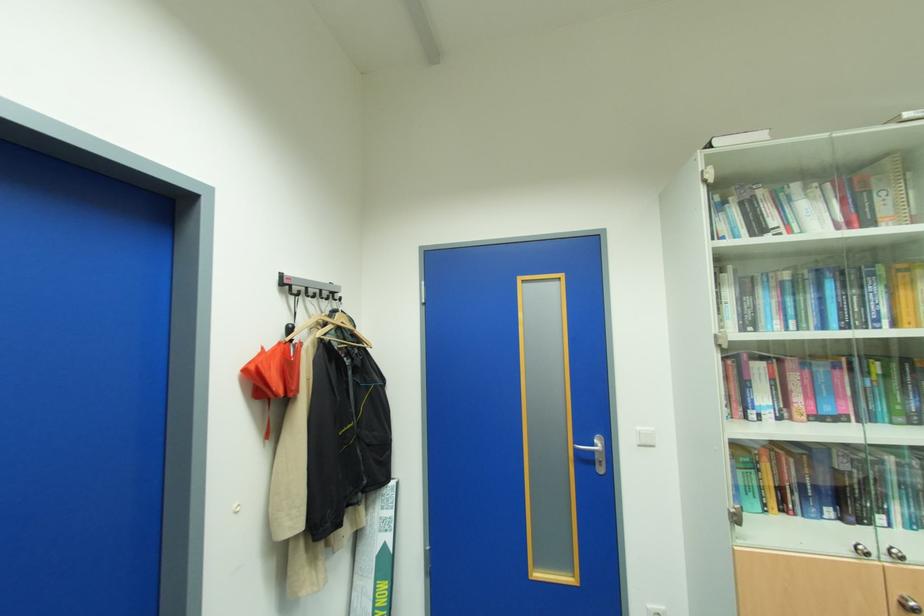
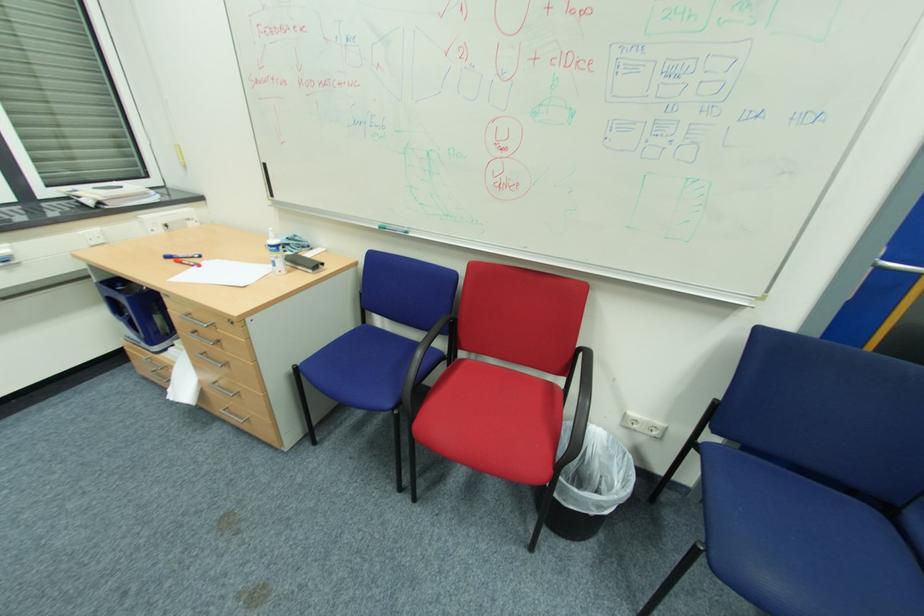
The images are taken continuously from a first-person perspective. In which direction is your viewpoint rotating?

The camera rotated toward left-down.